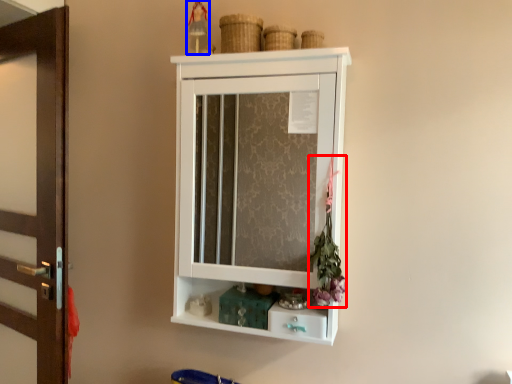
Question: Which of the following is the farthest to the observer, flower (highlighted by a red box) or toy (highlighted by a blue box)?

Choices:
 (A) flower
 (B) toy

Answer: (B)